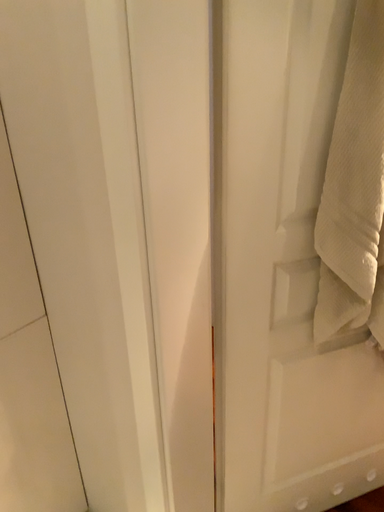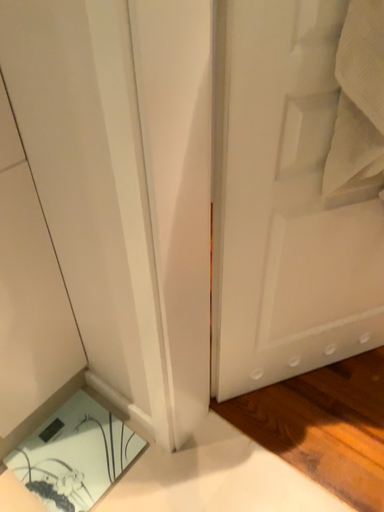
Question: Which way did the camera rotate in the video?

Choices:
 (A) rotated upward
 (B) rotated downward

Answer: (B)